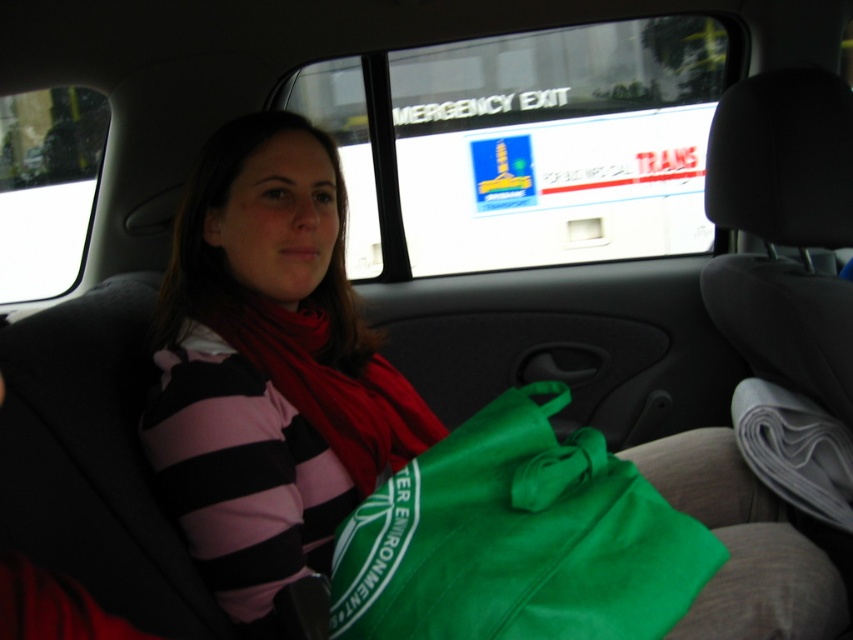
You are a passenger in the car and want to reach for the green fabric bag at center to grab your phone. However, there is a striped cotton shirt at center in the way. Can you easily access the bag without moving the shirt?

The striped cotton shirt at center is further to the viewer than green fabric bag at center, so the shirt is closer to you. This means you would need to move the shirt to access the bag, making it difficult to reach without adjusting the shirt.

You are sitting in the backseat of a car and want to grab your items. You have a green fabric bag at center and a red soft scarf at center. Which item is located to the right when you look at them?

The green fabric bag at center is to the right of the red soft scarf at center, so the green fabric bag at center is located to the right.

You are a passenger in the car and need to reach the point marked as point (256, 141) in the backseat. If your arm can reach up to 1.2 meters, can you comfortably reach that point?

The distance of point (256, 141) from the viewer is 1.25 meters, so your arm cannot reach it comfortably since it is slightly farther than your maximum reach of 1.2 meters.